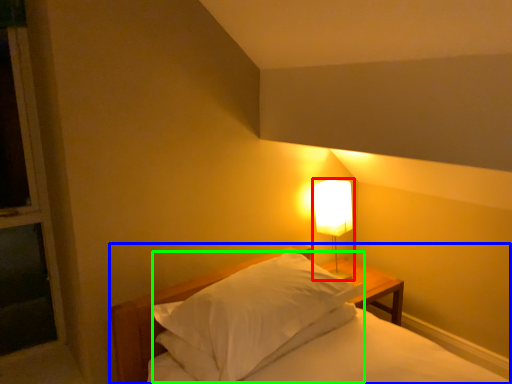
Question: Which object is the farthest from lamp (highlighted by a red box)? Choose among these: bed (highlighted by a blue box) or pillow (highlighted by a green box).

Choices:
 (A) bed
 (B) pillow

Answer: (B)